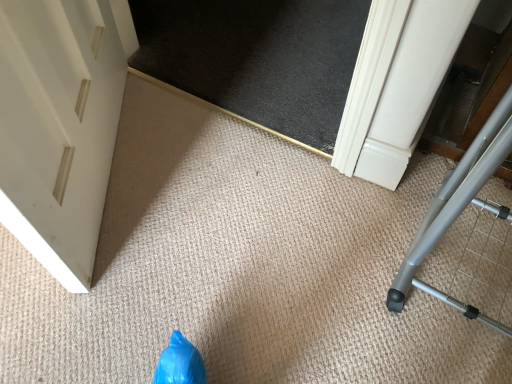
Describe the element at coordinates (257, 58) in the screenshot. I see `black textured mat at upper center` at that location.

Locate an element on the screen. black textured mat at upper center is located at coordinates (257, 58).

Locate an element on the screen. The image size is (512, 384). black textured mat at upper center is located at coordinates (257, 58).